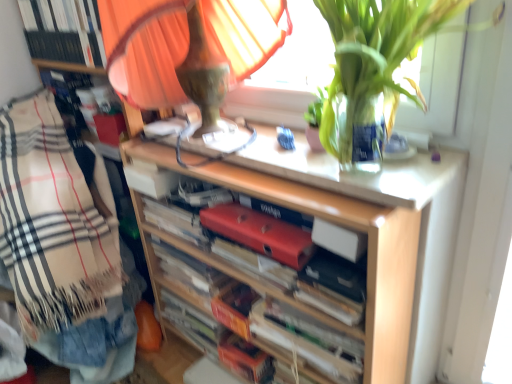
Question: Is beige plaid blanket at left wider than orange cardboard book at center, which appears as the 5th book when viewed from the top?

Choices:
 (A) no
 (B) yes

Answer: (B)

Question: From the image's perspective, does beige plaid blanket at left appear lower than orange cardboard book at center, positioned as the 1th book in bottom-to-top order?

Choices:
 (A) no
 (B) yes

Answer: (A)

Question: Can you confirm if beige plaid blanket at left is positioned to the right of orange cardboard book at center, positioned as the 1th book in bottom-to-top order?

Choices:
 (A) yes
 (B) no

Answer: (B)

Question: From a real-world perspective, is beige plaid blanket at left physically below orange cardboard book at center, which appears as the 5th book when viewed from the top?

Choices:
 (A) no
 (B) yes

Answer: (A)

Question: From the image's perspective, is beige plaid blanket at left located above orange cardboard book at center, positioned as the 1th book in bottom-to-top order?

Choices:
 (A) yes
 (B) no

Answer: (A)

Question: Can you confirm if beige plaid blanket at left is taller than orange cardboard book at center, positioned as the 1th book in bottom-to-top order?

Choices:
 (A) yes
 (B) no

Answer: (A)

Question: Considering the relative sizes of red matte folder at center, the 3th book when ordered from bottom to top, and beige plaid blanket at left in the image provided, is red matte folder at center, the 3th book when ordered from bottom to top, thinner than beige plaid blanket at left?

Choices:
 (A) yes
 (B) no

Answer: (A)

Question: Could you tell me if red matte folder at center, arranged as the 3th book when viewed from the top, is facing beige plaid blanket at left?

Choices:
 (A) no
 (B) yes

Answer: (A)

Question: Considering the relative sizes of red matte folder at center, the 3th book when ordered from bottom to top, and beige plaid blanket at left in the image provided, is red matte folder at center, the 3th book when ordered from bottom to top, taller than beige plaid blanket at left?

Choices:
 (A) no
 (B) yes

Answer: (A)

Question: From a real-world perspective, does red matte folder at center, the 3th book when ordered from bottom to top, stand above beige plaid blanket at left?

Choices:
 (A) yes
 (B) no

Answer: (A)

Question: Can you confirm if red matte folder at center, the 3th book when ordered from bottom to top, is positioned to the right of beige plaid blanket at left?

Choices:
 (A) yes
 (B) no

Answer: (A)

Question: Is red matte folder at center, the 3th book when ordered from bottom to top, smaller than beige plaid blanket at left?

Choices:
 (A) yes
 (B) no

Answer: (A)

Question: Does white paper book at center, the second book positioned from the bottom, have a lesser height compared to hardcover book at center, which is the first paperback book in bottom-to-top order?

Choices:
 (A) no
 (B) yes

Answer: (A)